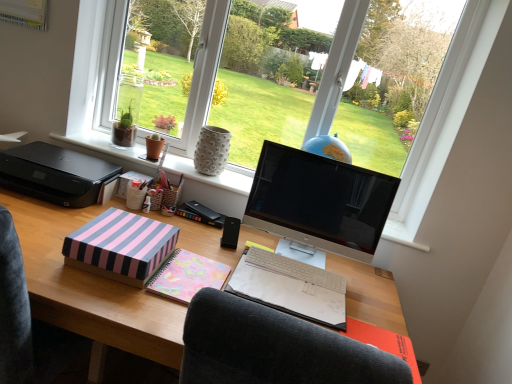
Identify the location of unoccupied space behind white plastic keyboard at center. (296, 253).